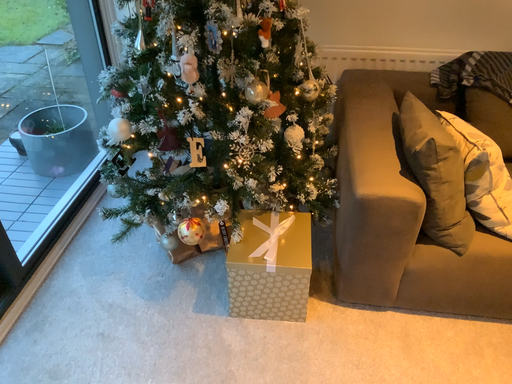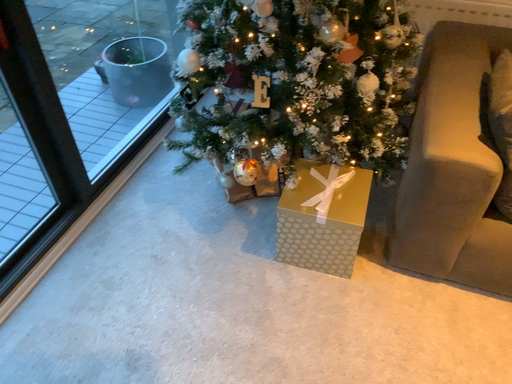
Question: How did the camera likely rotate when shooting the video?

Choices:
 (A) rotated right
 (B) rotated left

Answer: (B)